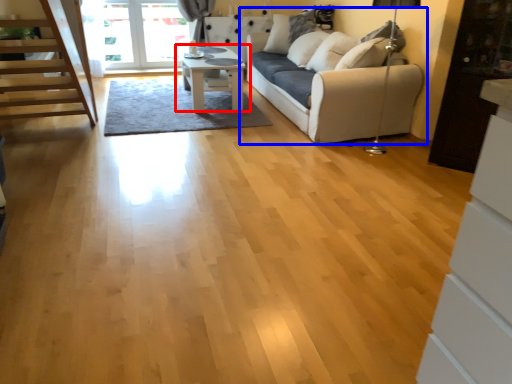
Question: Among these objects, which one is nearest to the camera, table (highlighted by a red box) or studio couch (highlighted by a blue box)?

Choices:
 (A) table
 (B) studio couch

Answer: (B)